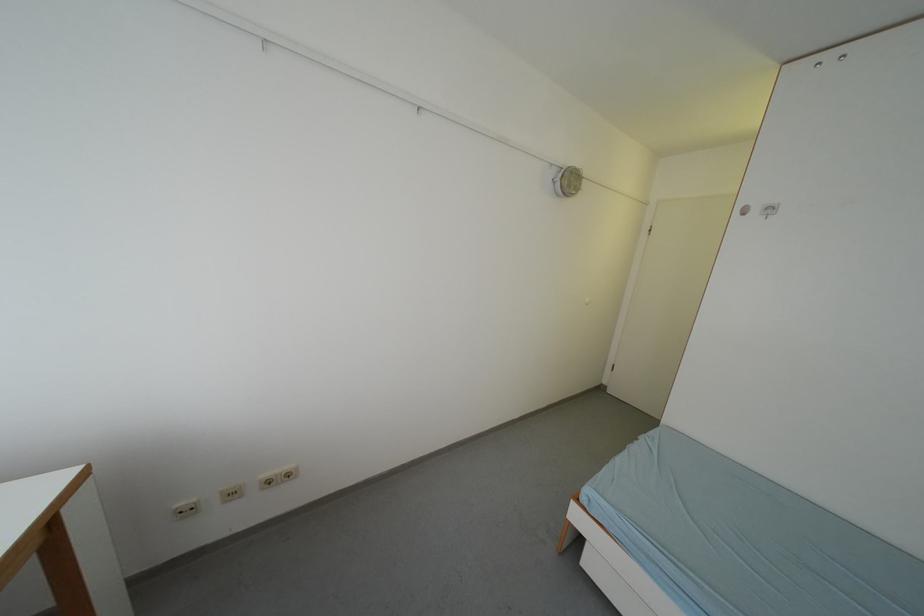
What do you see at coordinates (742, 208) in the screenshot?
I see `the white door handle` at bounding box center [742, 208].